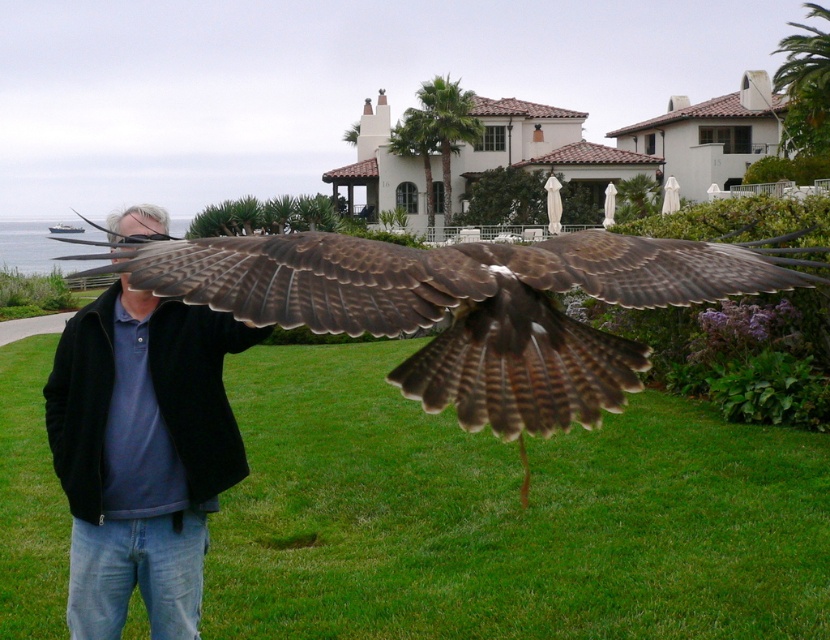
Question: Is brown feathered falcon at center wider than blue cotton shirt at center?

Choices:
 (A) yes
 (B) no

Answer: (A)

Question: Which point appears closest to the camera in this image?

Choices:
 (A) (706, 266)
 (B) (213, 397)

Answer: (A)

Question: Is brown feathered falcon at center above blue cotton shirt at center?

Choices:
 (A) no
 (B) yes

Answer: (B)

Question: Is brown feathered falcon at center to the right of blue cotton shirt at center from the viewer's perspective?

Choices:
 (A) no
 (B) yes

Answer: (B)

Question: Which point is farther from the camera taking this photo?

Choices:
 (A) (594, 296)
 (B) (125, 556)

Answer: (B)